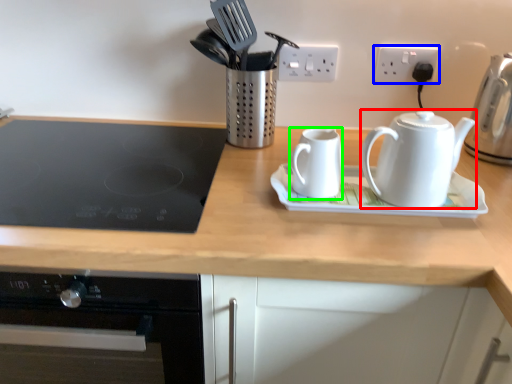
Question: Which is farther away from kettle (highlighted by a red box)? electric outlet (highlighted by a blue box) or kettle (highlighted by a green box)?

Choices:
 (A) electric outlet
 (B) kettle

Answer: (A)